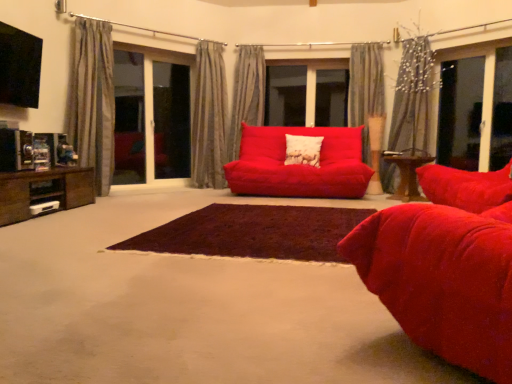
Question: Is white textured pillow at center facing towards velvet red studio couch at center?

Choices:
 (A) no
 (B) yes

Answer: (B)

Question: Are white textured pillow at center and velvet red studio couch at center located far from each other?

Choices:
 (A) yes
 (B) no

Answer: (A)

Question: Does white textured pillow at center have a greater width compared to velvet red studio couch at center?

Choices:
 (A) no
 (B) yes

Answer: (A)

Question: Does white textured pillow at center have a lesser height compared to velvet red studio couch at center?

Choices:
 (A) yes
 (B) no

Answer: (A)

Question: Is white textured pillow at center thinner than velvet red studio couch at center?

Choices:
 (A) no
 (B) yes

Answer: (B)

Question: Is white textured pillow at center not within velvet red studio couch at center?

Choices:
 (A) no
 (B) yes

Answer: (B)

Question: Does white textured pillow at center have a greater height compared to transparent glass screen door at left, the 1th screen door positioned from the right?

Choices:
 (A) no
 (B) yes

Answer: (A)

Question: Is white textured pillow at center positioned beyond the bounds of transparent glass screen door at left, the 1th screen door positioned from the right?

Choices:
 (A) no
 (B) yes

Answer: (B)

Question: Does white textured pillow at center have a lesser height compared to transparent glass screen door at left, arranged as the 2th screen door when viewed from the left?

Choices:
 (A) yes
 (B) no

Answer: (A)

Question: Considering the relative positions of white textured pillow at center and transparent glass screen door at left, the 1th screen door positioned from the right, in the image provided, is white textured pillow at center to the left of transparent glass screen door at left, the 1th screen door positioned from the right, from the viewer's perspective?

Choices:
 (A) no
 (B) yes

Answer: (A)

Question: From a real-world perspective, is white textured pillow at center over transparent glass screen door at left, arranged as the 2th screen door when viewed from the left?

Choices:
 (A) yes
 (B) no

Answer: (B)

Question: From the image's perspective, is white textured pillow at center over transparent glass screen door at left, arranged as the 2th screen door when viewed from the left?

Choices:
 (A) yes
 (B) no

Answer: (B)

Question: Is matte red couch at center turned away from transparent glass screen door at left, which is the first screen door from left to right?

Choices:
 (A) yes
 (B) no

Answer: (B)